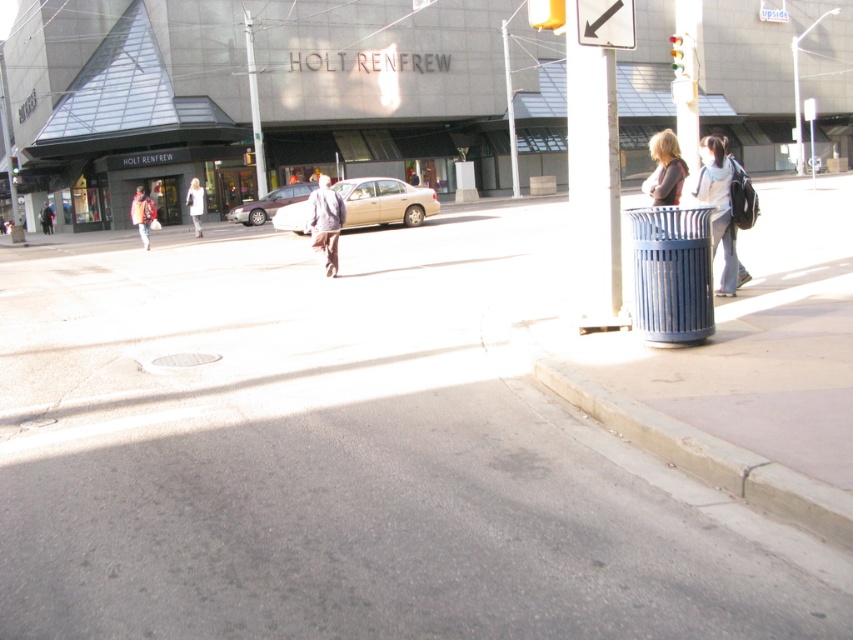
You are a delivery driver approaching the intersection and see the white plastic arrow at upper center and the white plastic upside down at upper center. Which object is taller?

The white plastic upside down at upper center is taller than the white plastic arrow at upper center.

You are a delivery driver who needs to park your vehicle near the white plastic pole at upper center. Based on the scene description, where would you position your car relative to the curb and the blue trash bin?

The white plastic pole at upper center is located at point (254, 108), so you should park your car near the curb on the right side of the image, close to the blue trash bin which is positioned beside the pole.

You are standing on the paved road in front of the HOLT RENFREW building and see two points marked in the image. Which point is closer to you, point [606,10] or point [200,232]?

Point [606,10] is closer to you than point [200,232].